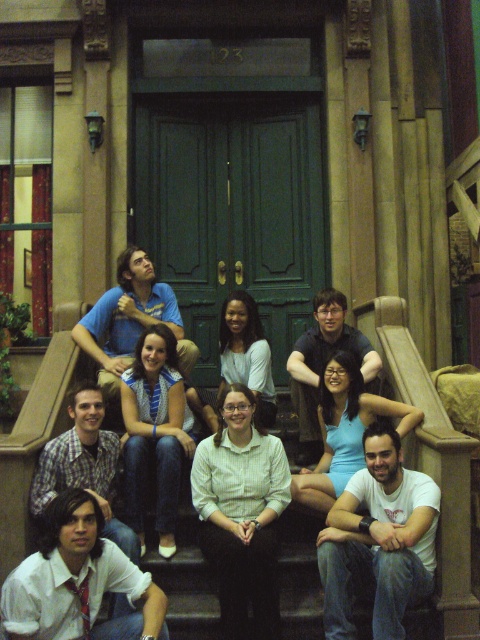
Question: Where is white glossy shirt at center located in relation to blue denim jeans at center in the image?

Choices:
 (A) left
 (B) right

Answer: (B)

Question: Which object is closer to the camera taking this photo?

Choices:
 (A) blue denim jeans at center
 (B) white shirt at center
 (C) white glossy shirt at center
 (D) light blue fabric dress at center

Answer: (B)

Question: Which object appears farthest from the camera in this image?

Choices:
 (A) white shirt at center
 (B) light blue fabric dress at center

Answer: (B)

Question: Can you confirm if white cotton t-shirt at lower right is positioned to the right of light blue fabric dress at center?

Choices:
 (A) no
 (B) yes

Answer: (B)

Question: Does white cotton t-shirt at lower right have a greater width compared to light blue fabric dress at center?

Choices:
 (A) no
 (B) yes

Answer: (A)

Question: Which of the following is the closest to the observer?

Choices:
 (A) (201, 540)
 (B) (134, 422)
 (C) (63, 497)
 (D) (347, 408)

Answer: (C)